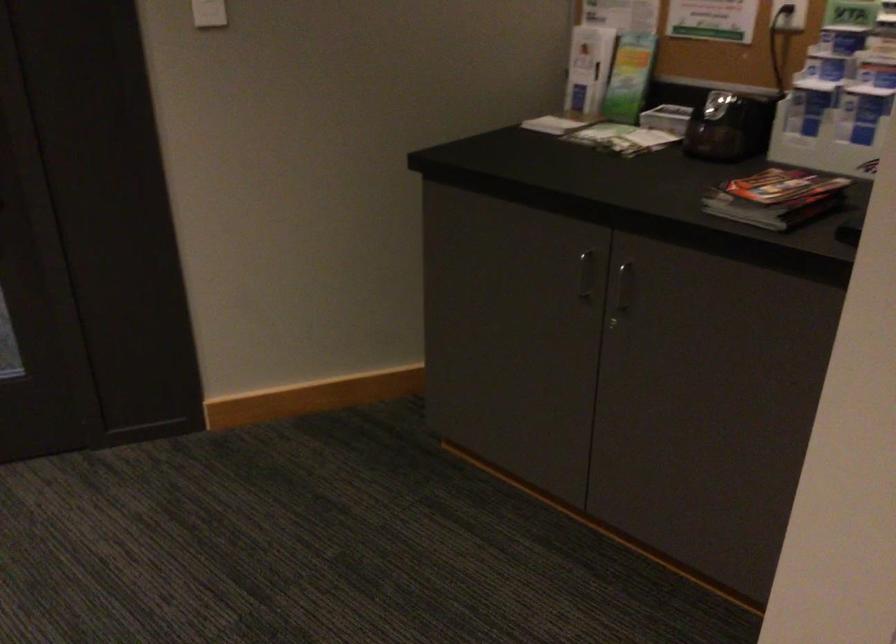
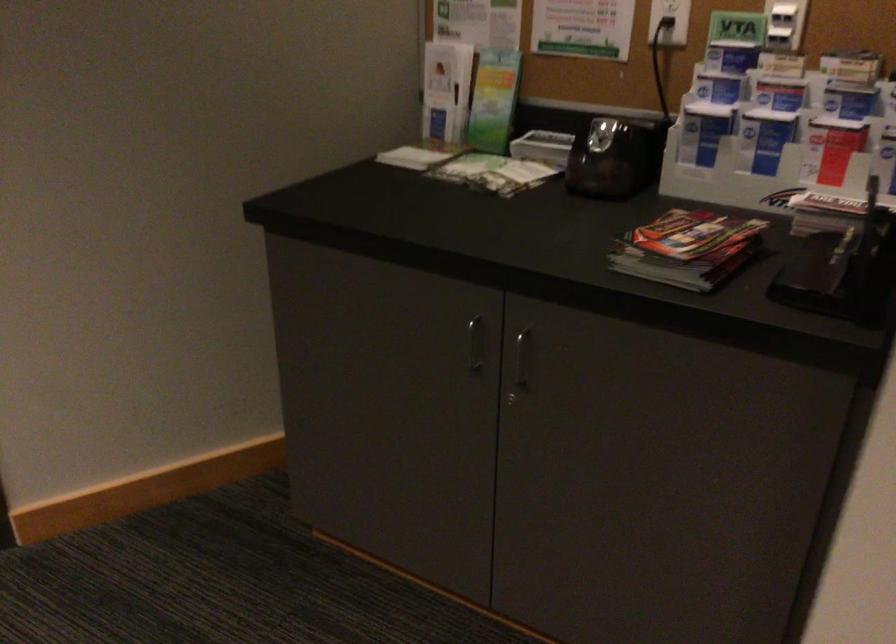
The point at (806, 104) is marked in the first image. Where is the corresponding point in the second image?

(702, 131)